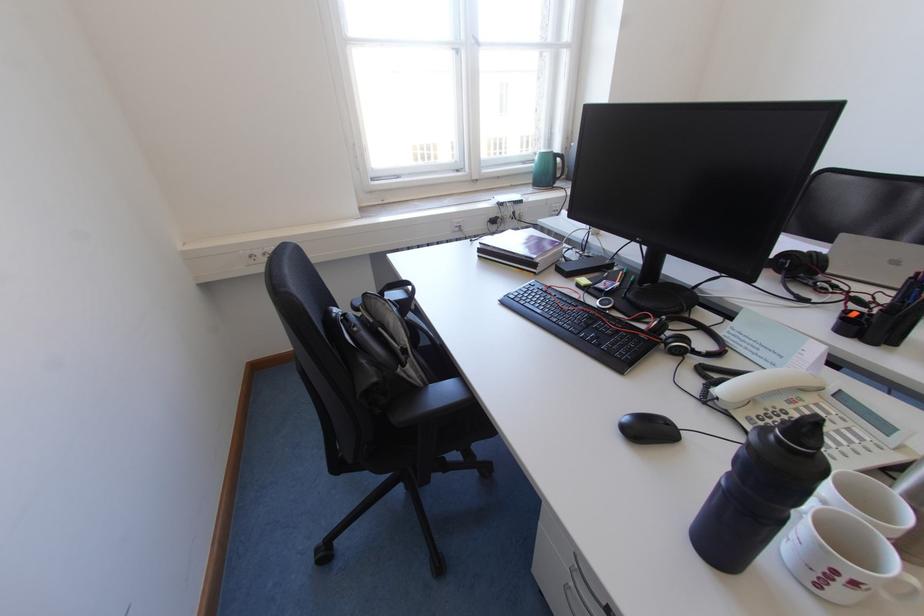
Find the location of a particular element. The width and height of the screenshot is (924, 616). black chair armrest is located at coordinates tap(441, 395).